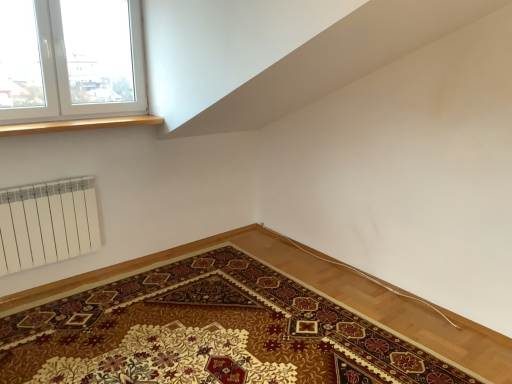
Question: Considering the relative sizes of carpeted mat at lower left and wooden at upper left in the image provided, is carpeted mat at lower left bigger than wooden at upper left?

Choices:
 (A) yes
 (B) no

Answer: (A)

Question: From a real-world perspective, is carpeted mat at lower left positioned under wooden at upper left based on gravity?

Choices:
 (A) no
 (B) yes

Answer: (B)

Question: From a real-world perspective, is carpeted mat at lower left positioned over wooden at upper left based on gravity?

Choices:
 (A) yes
 (B) no

Answer: (B)

Question: Would you say carpeted mat at lower left is a long distance from wooden at upper left?

Choices:
 (A) no
 (B) yes

Answer: (B)

Question: Is carpeted mat at lower left at the right side of wooden at upper left?

Choices:
 (A) no
 (B) yes

Answer: (B)

Question: From a real-world perspective, is wooden at upper left above or below carpeted mat at lower left?

Choices:
 (A) below
 (B) above

Answer: (B)

Question: Is wooden at upper left inside the boundaries of carpeted mat at lower left, or outside?

Choices:
 (A) outside
 (B) inside

Answer: (A)

Question: Considering the positions of wooden at upper left and carpeted mat at lower left in the image, is wooden at upper left wider or thinner than carpeted mat at lower left?

Choices:
 (A) thin
 (B) wide

Answer: (A)

Question: In the image, is wooden at upper left positioned in front of or behind carpeted mat at lower left?

Choices:
 (A) behind
 (B) front

Answer: (A)

Question: Considering their positions, is white plastic window at upper left located in front of or behind wooden at upper left?

Choices:
 (A) behind
 (B) front

Answer: (B)

Question: From a real-world perspective, is white plastic window at upper left positioned above or below wooden at upper left?

Choices:
 (A) above
 (B) below

Answer: (A)

Question: Looking at their shapes, would you say white plastic window at upper left is wider or thinner than wooden at upper left?

Choices:
 (A) wide
 (B) thin

Answer: (B)

Question: Is point (29, 24) positioned closer to the camera than point (10, 130)?

Choices:
 (A) closer
 (B) farther

Answer: (A)

Question: Is white plastic window at upper left spatially inside carpeted mat at lower left, or outside of it?

Choices:
 (A) outside
 (B) inside

Answer: (A)

Question: From a real-world perspective, is white plastic window at upper left positioned above or below carpeted mat at lower left?

Choices:
 (A) above
 (B) below

Answer: (A)